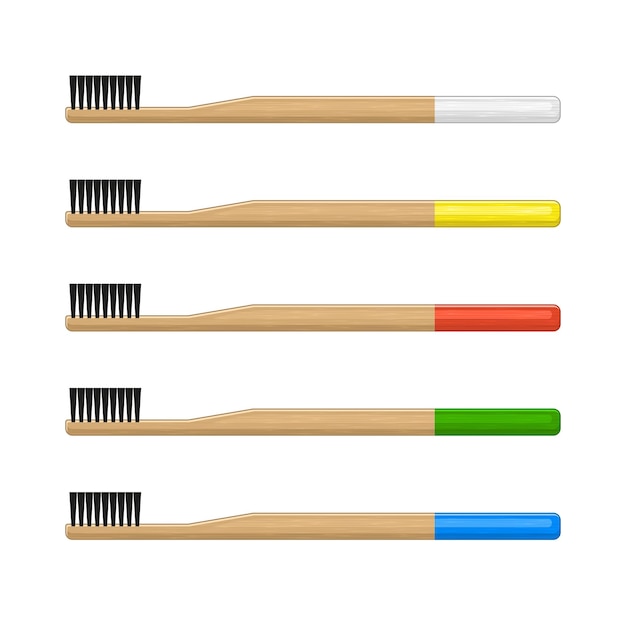
What are the coordinates of `green paint` in the screenshot? It's located at pyautogui.click(x=486, y=427).